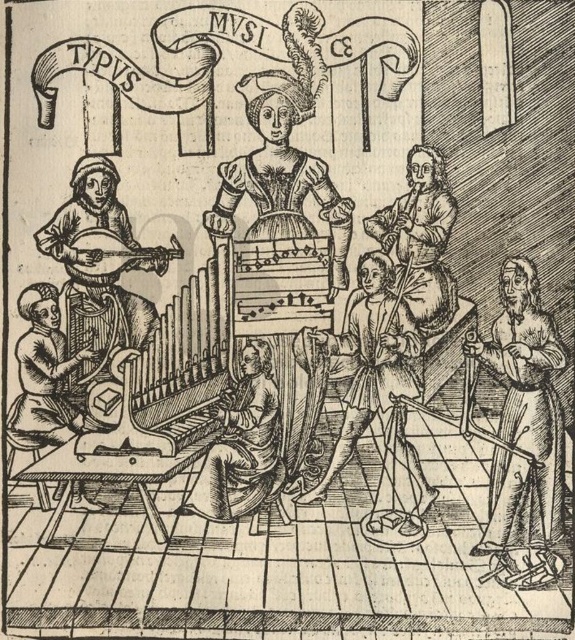
You are an art historian examining this woodcut. You notice two points marked in the scene. The first point is at coordinate point (543,472) and the second is at coordinate point (121,257). Which of these two points is situated closer to the viewer in the three dimensional space of the artwork?

Point (543,472) is closer to the viewer than point (121,257).

Based on the scene description, which object is larger in size between the matte black organ at center and the wooden lute at left?

The matte black organ at center is bigger than the wooden lute at left.